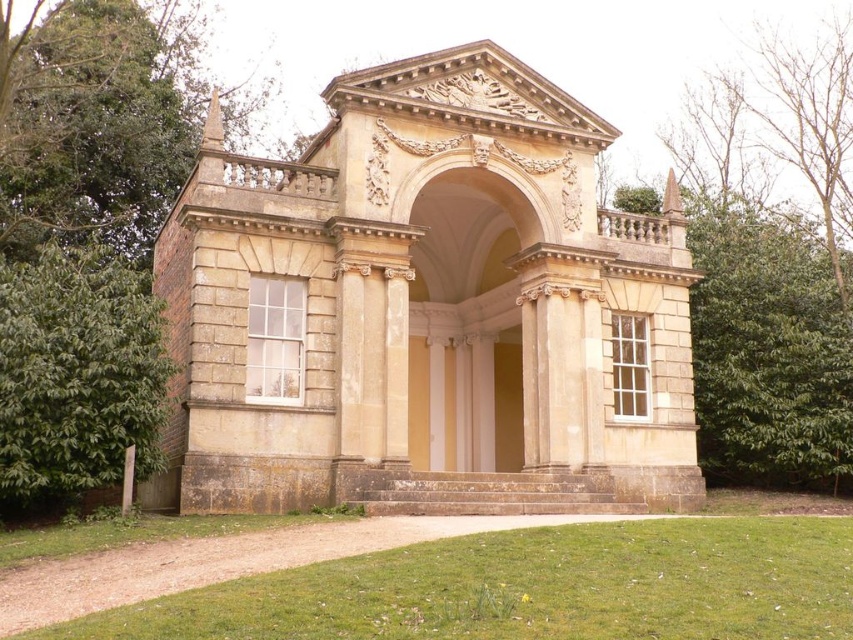
Question: Which object appears closest to the camera in this image?

Choices:
 (A) green leafy tree at left
 (B) green leafy tree at upper left

Answer: (A)

Question: Does green leafy tree at upper left appear over green leafy tree at left?

Choices:
 (A) yes
 (B) no

Answer: (A)

Question: Is green leafy tree at upper left above green leafy tree at left?

Choices:
 (A) yes
 (B) no

Answer: (A)

Question: Which object is farther from the camera taking this photo?

Choices:
 (A) green leafy tree at left
 (B) green leafy tree at upper left

Answer: (B)

Question: In this image, where is green leafy tree at upper left located relative to green leafy tree at left?

Choices:
 (A) above
 (B) below

Answer: (A)

Question: Which object is closer to the camera taking this photo?

Choices:
 (A) green leafy tree at left
 (B) green leafy tree at upper left

Answer: (A)